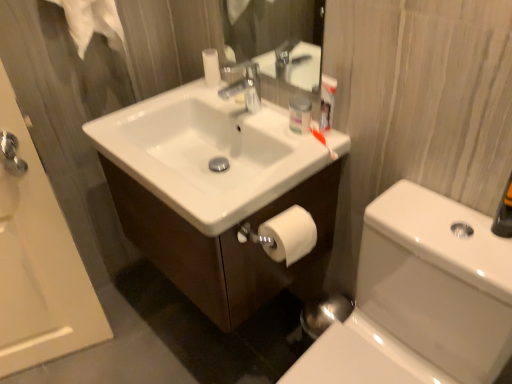
Find the location of `vacant area to the left of matte plastic container at upper center`. vacant area to the left of matte plastic container at upper center is located at coordinates (260, 117).